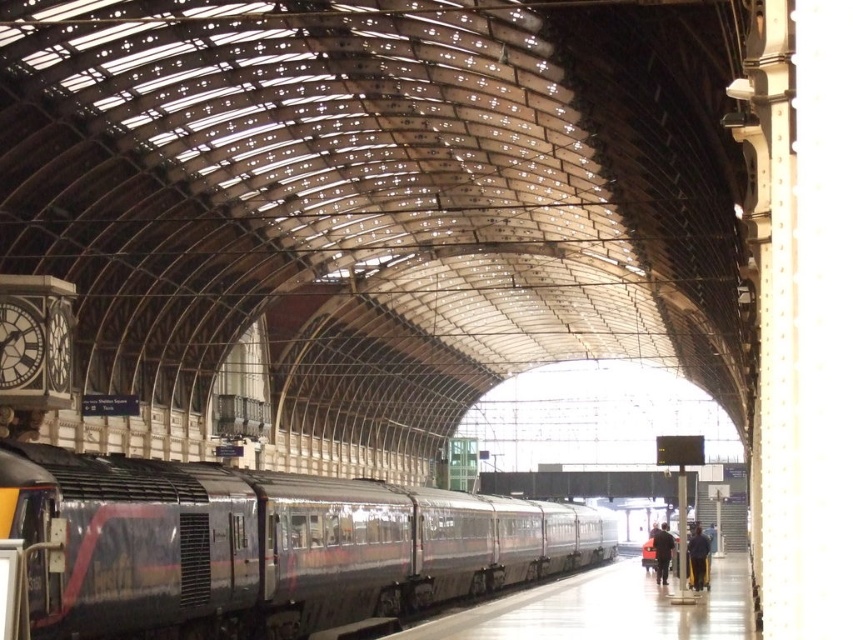
Is point (248, 600) positioned in front of point (689, 573)?

Yes.

Where is `polished dark gray train at center`? Image resolution: width=853 pixels, height=640 pixels. polished dark gray train at center is located at coordinates (263, 545).

Does point (189, 468) lie behind point (670, 552)?

That is False.

Does point (171, 625) come closer to viewer compared to point (665, 548)?

Yes.

Is point (35, 637) in front of point (659, 572)?

That is True.

Identify the location of polished dark gray train at center. This screenshot has height=640, width=853. (263, 545).

Is point (694, 531) closer to viewer compared to point (660, 552)?

No, it is behind (660, 552).

Is dark blue jacket at center below dark blue jacket at lower right?

No.

Is point (692, 547) farther from camera compared to point (654, 547)?

No, (692, 547) is in front of (654, 547).

Identify the location of dark blue jacket at center. (698, 557).